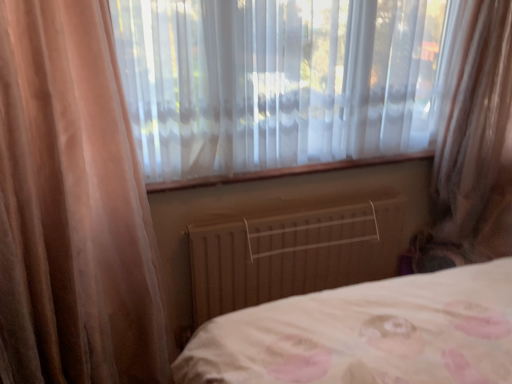
Question: Is translucent fabric curtain at right in front of wooden radiator at center?

Choices:
 (A) no
 (B) yes

Answer: (B)

Question: From a real-world perspective, is translucent fabric curtain at right on top of wooden radiator at center?

Choices:
 (A) no
 (B) yes

Answer: (B)

Question: Is translucent fabric curtain at right far away from wooden radiator at center?

Choices:
 (A) no
 (B) yes

Answer: (A)

Question: Is translucent fabric curtain at right oriented towards wooden radiator at center?

Choices:
 (A) no
 (B) yes

Answer: (A)

Question: From the image's perspective, is translucent fabric curtain at right located beneath wooden radiator at center?

Choices:
 (A) yes
 (B) no

Answer: (B)

Question: Is translucent fabric curtain at right wider or thinner than wooden radiator at center?

Choices:
 (A) thin
 (B) wide

Answer: (B)

Question: From the image's perspective, relative to wooden radiator at center, is translucent fabric curtain at right above or below?

Choices:
 (A) below
 (B) above

Answer: (B)

Question: From a real-world perspective, is translucent fabric curtain at right physically located above or below wooden radiator at center?

Choices:
 (A) above
 (B) below

Answer: (A)

Question: Visually, is translucent fabric curtain at right positioned to the left or to the right of wooden radiator at center?

Choices:
 (A) left
 (B) right

Answer: (B)

Question: From a real-world perspective, relative to translucent fabric at center, is wooden radiator at center vertically above or below?

Choices:
 (A) below
 (B) above

Answer: (A)

Question: Considering the relative positions of wooden radiator at center and translucent fabric at center in the image provided, is wooden radiator at center to the left or to the right of translucent fabric at center?

Choices:
 (A) right
 (B) left

Answer: (A)

Question: From the image's perspective, relative to translucent fabric at center, is wooden radiator at center above or below?

Choices:
 (A) below
 (B) above

Answer: (A)

Question: Considering the positions of wooden radiator at center and translucent fabric at center in the image, is wooden radiator at center wider or thinner than translucent fabric at center?

Choices:
 (A) wide
 (B) thin

Answer: (B)

Question: Considering the positions of translucent fabric curtain at right and translucent fabric at center in the image, is translucent fabric curtain at right taller or shorter than translucent fabric at center?

Choices:
 (A) tall
 (B) short

Answer: (A)

Question: Considering the positions of translucent fabric curtain at right and translucent fabric at center in the image, is translucent fabric curtain at right wider or thinner than translucent fabric at center?

Choices:
 (A) wide
 (B) thin

Answer: (A)